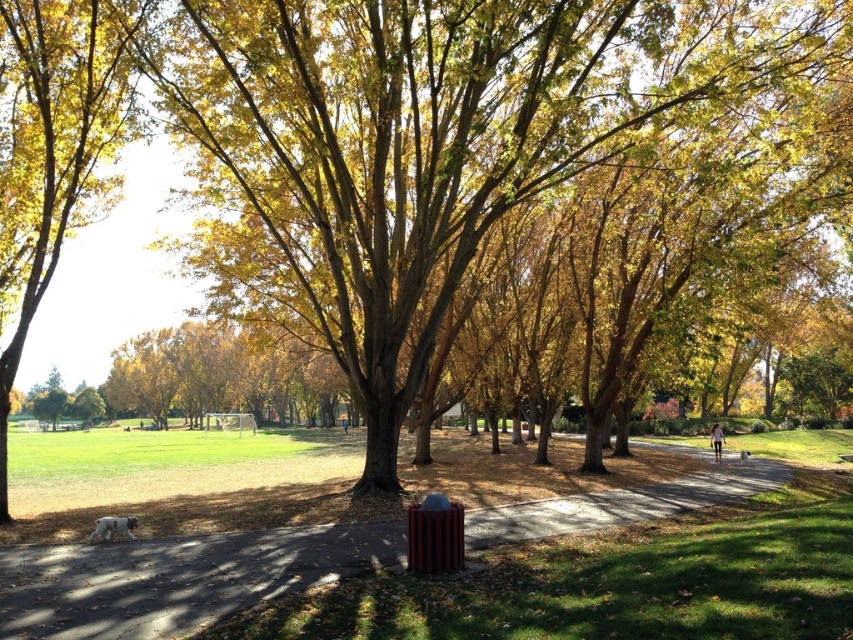
You are a park maintenance worker who needs to place a new bench between the metallic trash can at center and the golden leafy tree at center. The bench is 6 feet long. Is there enough space between them to place the bench without moving either object?

The metallic trash can at center and the golden leafy tree at center are 26.62 feet apart, so yes, there is enough space to place a 6 feet long bench between them since the distance between them is greater than the bench length.

You are standing in the park and see the metallic trash can at center. If you walk straight ahead, how far will you have to walk to reach it?

The metallic trash can at center is 20.12 feet away from you, so you will have to walk 20.12 feet to reach it.

You are a gardener who needs to place a new bench in the park. The bench is 1.5 meters wide. You see the metallic trash can at center and the golden leafy tree at center. Can you fit the bench between them without blocking the path?

The metallic trash can at center is smaller than the golden leafy tree at center, but the description does not provide specific distance between them. Therefore, it is uncertain whether the bench will fit between them without blocking the path.